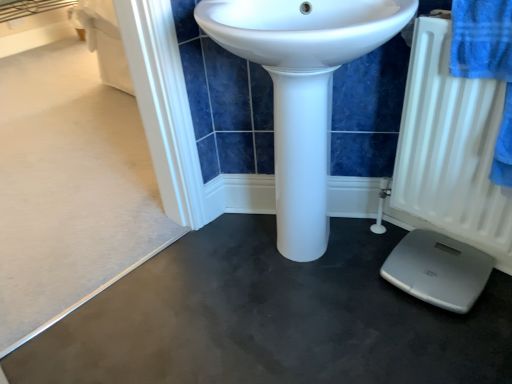
What are the coordinates of `vacant space underneath white glossy sink at center (from a real-world perspective)` in the screenshot? It's located at (302, 263).